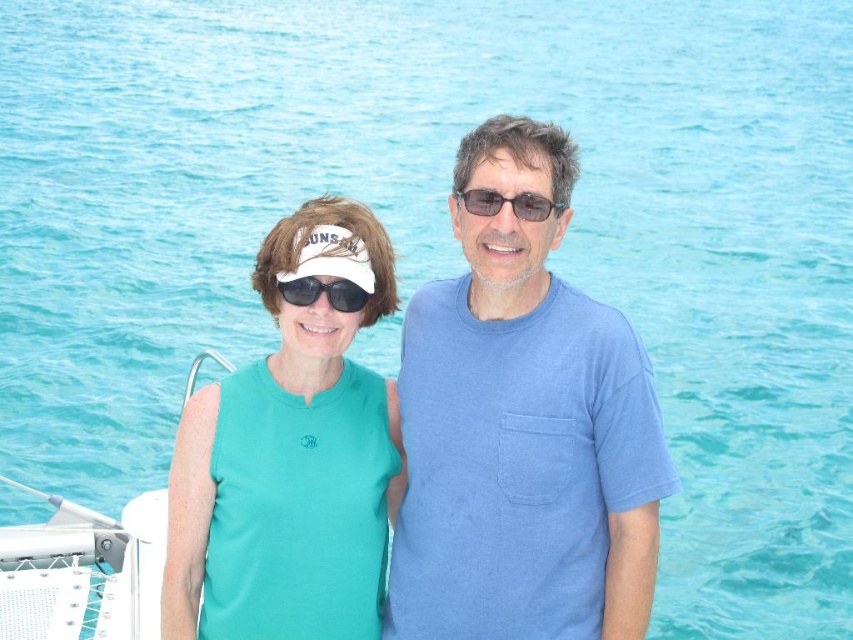
Is teal fabric visor at left taller than black reflective sunglasses at center?

Indeed, teal fabric visor at left has a greater height compared to black reflective sunglasses at center.

The image size is (853, 640). What do you see at coordinates (289, 458) in the screenshot? I see `teal fabric visor at left` at bounding box center [289, 458].

This screenshot has height=640, width=853. What do you see at coordinates (289, 458) in the screenshot? I see `teal fabric visor at left` at bounding box center [289, 458].

Locate an element on the screen. teal fabric visor at left is located at coordinates (289, 458).

What do you see at coordinates (289, 458) in the screenshot?
I see `teal fabric visor at left` at bounding box center [289, 458].

Does teal fabric visor at left have a greater height compared to glossy plastic sunglasses at center?

Yes, teal fabric visor at left is taller than glossy plastic sunglasses at center.

This screenshot has height=640, width=853. I want to click on teal fabric visor at left, so click(289, 458).

Who is positioned more to the left, light blue cotton t-shirt at center or glossy plastic sunglasses at center?

light blue cotton t-shirt at center

Does light blue cotton t-shirt at center appear on the left side of glossy plastic sunglasses at center?

Indeed, light blue cotton t-shirt at center is positioned on the left side of glossy plastic sunglasses at center.

Who is more distant from viewer, [426,404] or [492,212]?

Point [426,404]

At what (x,y) coordinates should I click in order to perform the action: click on light blue cotton t-shirt at center. Please return your answer as a coordinate pair (x, y). Looking at the image, I should click on (521, 428).